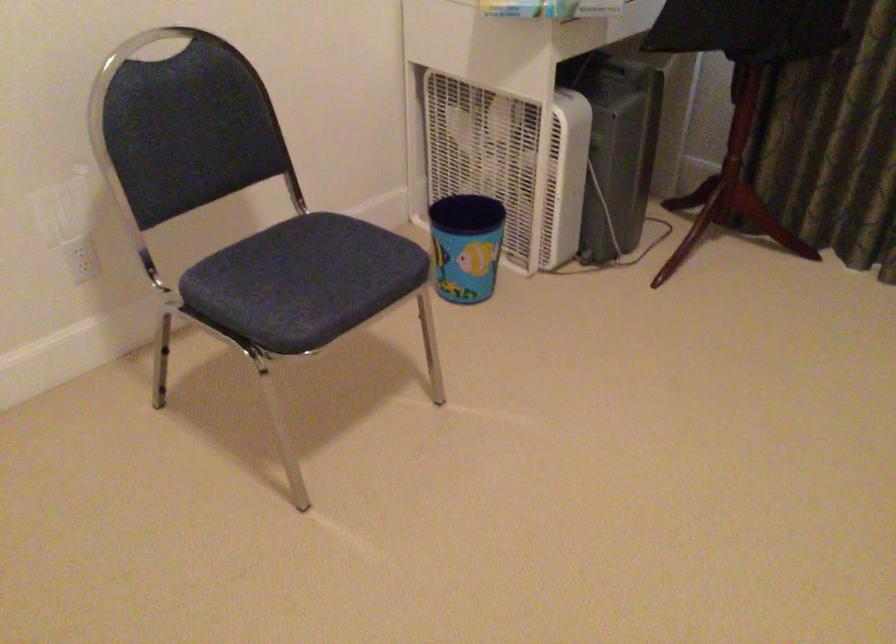
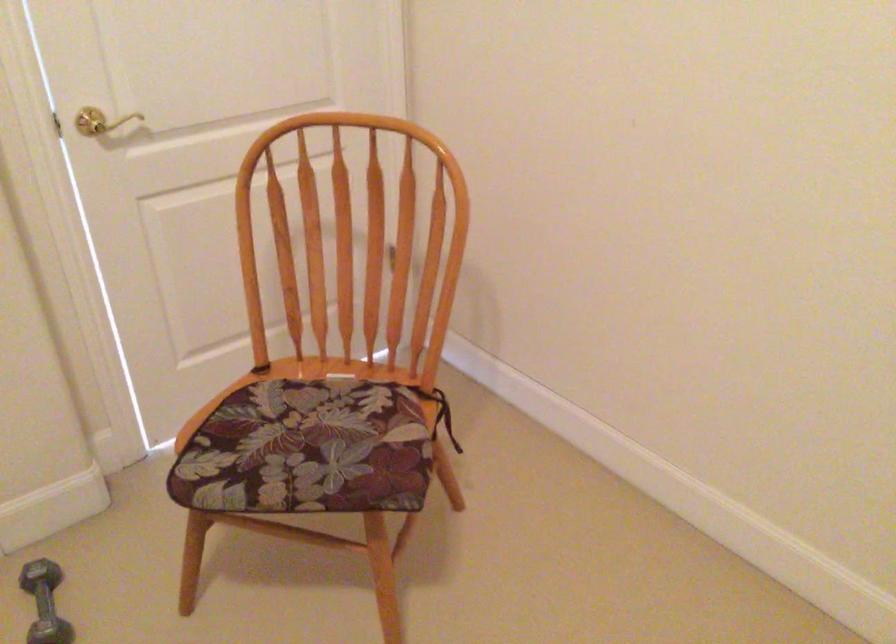
Looking at this image, the images are taken continuously from a first-person perspective. In which direction is your viewpoint rotating?

The camera rotated toward left-down.